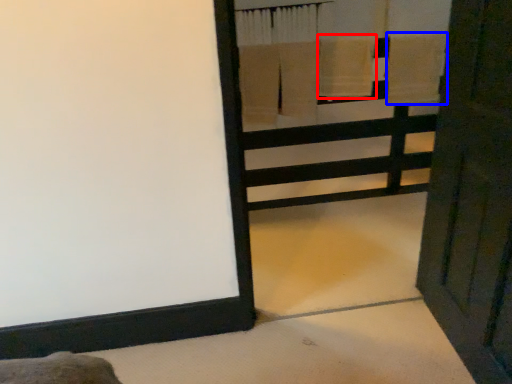
Question: Among these objects, which one is nearest to the camera, bath towel (highlighted by a red box) or bath towel (highlighted by a blue box)?

Choices:
 (A) bath towel
 (B) bath towel

Answer: (A)